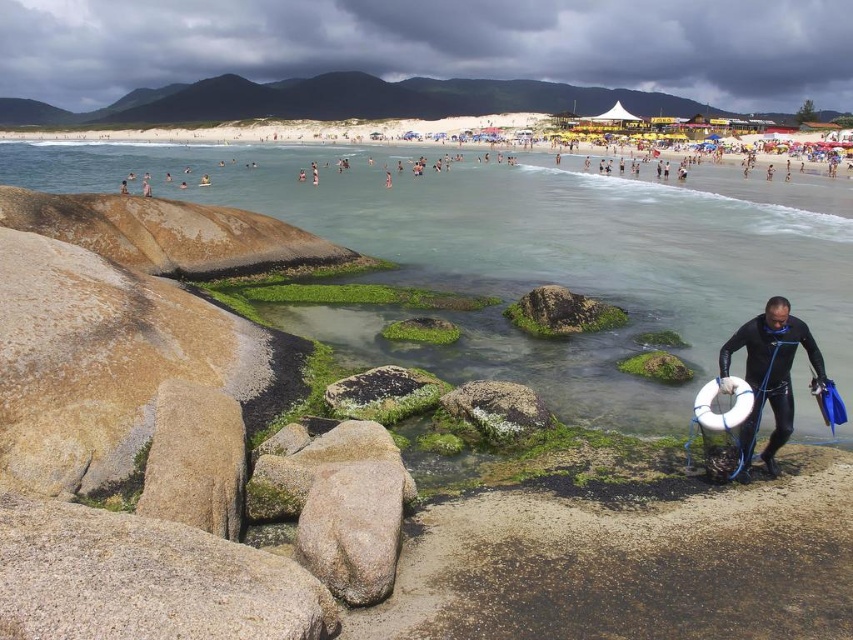
Question: Which point is closer to the camera taking this photo?

Choices:
 (A) (810, 340)
 (B) (384, 481)
 (C) (167, 388)
 (D) (318, 616)

Answer: (D)

Question: Considering the relative positions of gray rough rock at left and gray rough rock at center in the image provided, where is gray rough rock at left located with respect to gray rough rock at center?

Choices:
 (A) right
 (B) left

Answer: (B)

Question: Which of the following is the farthest from the observer?

Choices:
 (A) (97, 520)
 (B) (152, 497)

Answer: (B)

Question: Is gray rough rock at center positioned behind black wetsuit at lower right?

Choices:
 (A) yes
 (B) no

Answer: (B)

Question: Which point is closer to the camera taking this photo?

Choices:
 (A) (786, 401)
 (B) (373, 586)
 (C) (146, 513)
 (D) (54, 600)

Answer: (D)

Question: Does gray granite rock at lower left lie in front of gray rough rock at center?

Choices:
 (A) no
 (B) yes

Answer: (B)